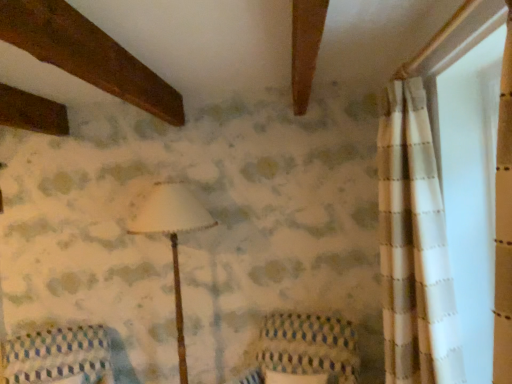
Measure the distance between point [211,225] and camera.

A distance of 2.65 meters exists between point [211,225] and camera.

Identify the location of knitted fabric armchair at center. This screenshot has height=384, width=512. (304, 351).

Is point (42, 330) positioned behind point (154, 218)?

Yes, it is.

Which is in front, patterned fabric cushion at lower left or white matte lampshade at center?

patterned fabric cushion at lower left.

Is patterned fabric cushion at lower left bigger than white matte lampshade at center?

No, patterned fabric cushion at lower left is not bigger than white matte lampshade at center.

Between patterned fabric cushion at lower left and white matte lampshade at center, which one has larger width?

Wider between the two is patterned fabric cushion at lower left.

Is white matte lampshade at center beside knitted fabric armchair at center?

No, white matte lampshade at center is not in contact with knitted fabric armchair at center.

From a real-world perspective, is white matte lampshade at center beneath knitted fabric armchair at center?

No, from a real-world perspective, white matte lampshade at center is not under knitted fabric armchair at center.

Would you say white matte lampshade at center is to the left or to the right of knitted fabric armchair at center in the picture?

In the image, white matte lampshade at center appears on the left side of knitted fabric armchair at center.

Identify the location of armchair that appears in front of the patterned fabric cushion at lower left. click(304, 351).

Is knitted fabric armchair at center taller than patterned fabric cushion at lower left?

Yes, knitted fabric armchair at center is taller than patterned fabric cushion at lower left.

From a real-world perspective, which object rests below the other?

knitted fabric armchair at center.

Is knitted fabric armchair at center thinner than patterned fabric cushion at lower left?

Correct, the width of knitted fabric armchair at center is less than that of patterned fabric cushion at lower left.

Which is more to the left, patterned fabric cushion at lower left or knitted fabric armchair at center?

Positioned to the left is patterned fabric cushion at lower left.

Where is `furniture that appears above the knitted fabric armchair at center (from a real-world perspective)`? The image size is (512, 384). furniture that appears above the knitted fabric armchair at center (from a real-world perspective) is located at coordinates (57, 357).

From the image's perspective, which one is positioned higher, patterned fabric cushion at lower left or knitted fabric armchair at center?

From the image's view, knitted fabric armchair at center is above.

Which point is more distant from viewer, (185, 202) or (7, 377)?

Positioned behind is point (7, 377).

Considering the sizes of objects white matte lampshade at center and patterned fabric cushion at lower left in the image provided, who is shorter, white matte lampshade at center or patterned fabric cushion at lower left?

With less height is patterned fabric cushion at lower left.

Considering the sizes of objects white matte lampshade at center and patterned fabric cushion at lower left in the image provided, who is bigger, white matte lampshade at center or patterned fabric cushion at lower left?

white matte lampshade at center.

Which of these two, white matte lampshade at center or patterned fabric cushion at lower left, is wider?

Wider between the two is patterned fabric cushion at lower left.

Between knitted fabric armchair at center and white matte lampshade at center, which one has smaller width?

With smaller width is white matte lampshade at center.

Can you confirm if knitted fabric armchair at center is positioned to the left of white matte lampshade at center?

No.

Which is correct: knitted fabric armchair at center is inside white matte lampshade at center, or outside of it?

knitted fabric armchair at center is located beyond the bounds of white matte lampshade at center.

Between knitted fabric armchair at center and white matte lampshade at center, which one has smaller size?

Smaller between the two is knitted fabric armchair at center.

This screenshot has height=384, width=512. Find the location of `lamp on the right of patterned fabric cushion at lower left`. lamp on the right of patterned fabric cushion at lower left is located at coordinates (173, 237).

Where is `lamp lying on the left of knitted fabric armchair at center`? The image size is (512, 384). lamp lying on the left of knitted fabric armchair at center is located at coordinates (173, 237).

Based on their spatial positions, is white matte lampshade at center or knitted fabric armchair at center further from patterned fabric cushion at lower left?

knitted fabric armchair at center.

Which object lies nearer to the anchor point knitted fabric armchair at center, white matte lampshade at center or patterned fabric cushion at lower left?

Based on the image, white matte lampshade at center appears to be nearer to knitted fabric armchair at center.

When comparing their distances from white matte lampshade at center, does patterned fabric cushion at lower left or knitted fabric armchair at center seem further?

patterned fabric cushion at lower left is further to white matte lampshade at center.

Considering their positions, is knitted fabric armchair at center positioned closer to white matte lampshade at center than patterned fabric cushion at lower left?

knitted fabric armchair at center lies closer to white matte lampshade at center than the other object.

From the image, which object appears to be farther from knitted fabric armchair at center, patterned fabric cushion at lower left or white matte lampshade at center?

patterned fabric cushion at lower left is further to knitted fabric armchair at center.

Looking at the image, which one is located further to patterned fabric cushion at lower left, knitted fabric armchair at center or white matte lampshade at center?

knitted fabric armchair at center is positioned further to the anchor patterned fabric cushion at lower left.

I want to click on lamp situated between patterned fabric cushion at lower left and knitted fabric armchair at center from left to right, so click(x=173, y=237).